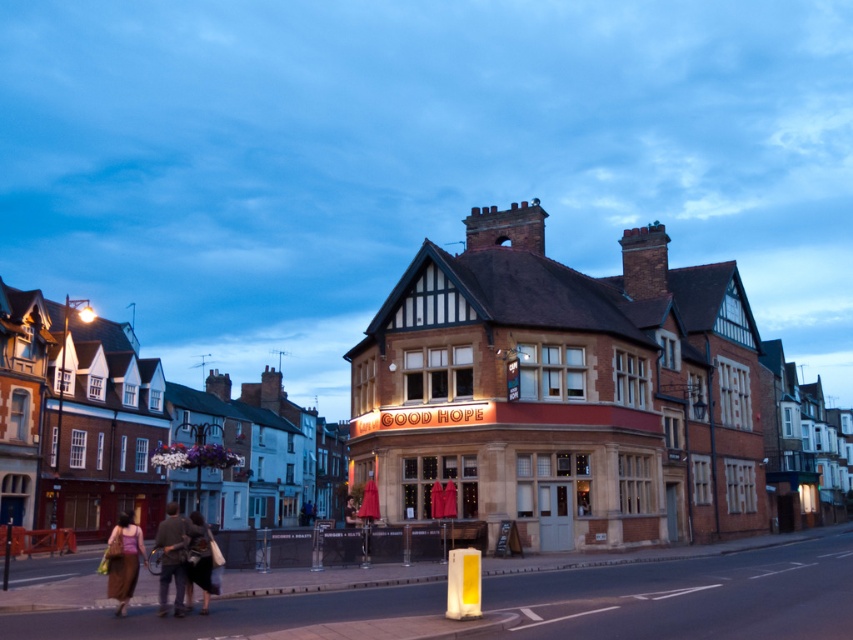
Where is `brown leather jacket at lower left`? brown leather jacket at lower left is located at coordinates (173, 556).

Between brown leather jacket at lower left and brown textured dress at lower left, which one has more height?

With more height is brown leather jacket at lower left.

Does point (165, 532) lie in front of point (117, 580)?

That is False.

Where is `brown leather jacket at lower left`? The image size is (853, 640). brown leather jacket at lower left is located at coordinates (173, 556).